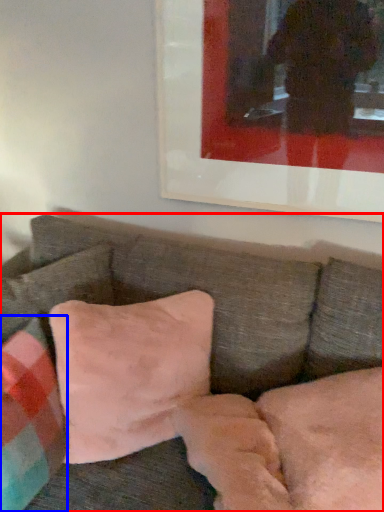
Question: Among these objects, which one is farthest to the camera, studio couch (highlighted by a red box) or pillow (highlighted by a blue box)?

Choices:
 (A) studio couch
 (B) pillow

Answer: (B)